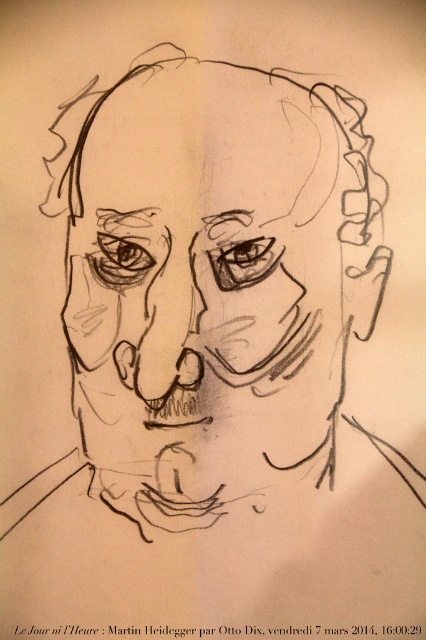
You are an art student analyzing the pencil sketch of a man. You notice the graphite sketch of head at center and the matte black nose at center. Based on the sketch, which object is closer to the viewer?

The graphite sketch of head at center is closer to the viewer than the matte black nose at center.

Consider the image. You are an art student analyzing the pencil sketch of a man. You notice two points in the drawing, one at coordinates point (149,412) and another at point (152,285). Based on the shading and perspective, which of these points is closer to the viewer?

Point (149,412) is closer to the viewer than point (152,285) because it is further to the viewer according to the description.